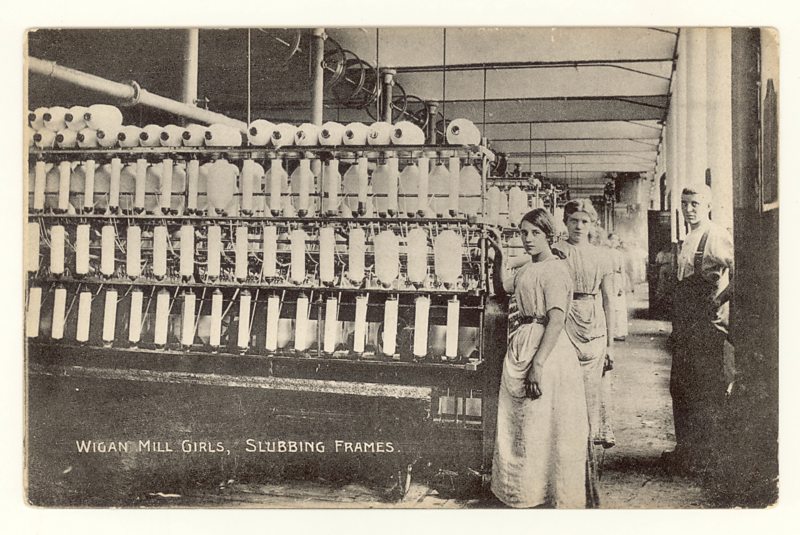
Where is `light colored floor`? Image resolution: width=800 pixels, height=535 pixels. light colored floor is located at coordinates (640, 385).